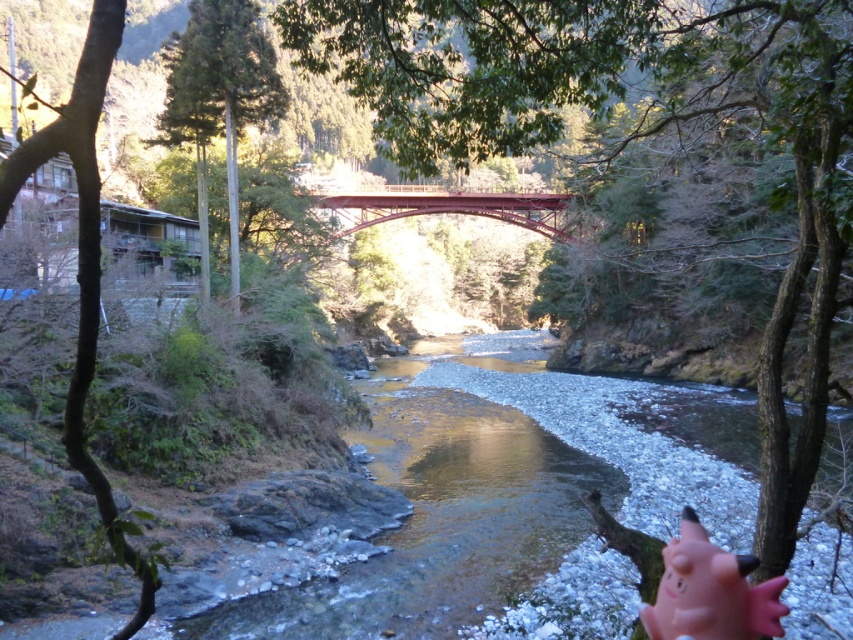
Is point (824, 556) positioned before point (671, 556)?

No, it is not.

Measure the distance between point (x=631, y=416) and camera.

They are 31.70 meters apart.

Is point (465, 573) farther from viewer compared to point (689, 560)?

Yes, it is behind point (689, 560).

Locate an element on the screen. clear water at center is located at coordinates (515, 502).

Can you confirm if pink rubber pig at lower right is shorter than metallic bridge at center?

Indeed, pink rubber pig at lower right has a lesser height compared to metallic bridge at center.

Is point (695, 561) farther from viewer compared to point (561, 204)?

No.

Identify the location of pink rubber pig at lower right. This screenshot has height=640, width=853. (711, 592).

Where is `pink rubber pig at lower right`? The image size is (853, 640). pink rubber pig at lower right is located at coordinates (711, 592).

Can you confirm if clear water at center is thinner than metallic bridge at center?

In fact, clear water at center might be wider than metallic bridge at center.

Does clear water at center have a larger size compared to metallic bridge at center?

No, clear water at center is not bigger than metallic bridge at center.

Is point (380, 387) positioned after point (410, 189)?

That is False.

In order to click on clear water at center in this screenshot , I will do `click(515, 502)`.